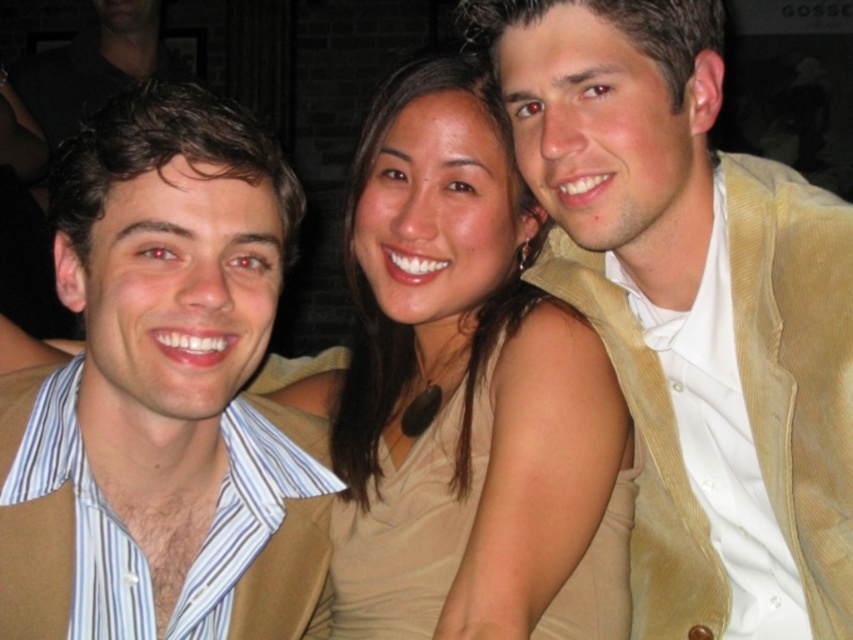
Question: Which of the following is the closest to the observer?

Choices:
 (A) tan corduroy vest at center
 (B) matte brown vest at left
 (C) matte beige dress at center

Answer: (C)

Question: Is the position of matte brown vest at left less distant than that of matte black shirt at left?

Choices:
 (A) no
 (B) yes

Answer: (B)

Question: Is matte brown vest at left smaller than matte beige dress at center?

Choices:
 (A) no
 (B) yes

Answer: (B)

Question: Is matte beige dress at center bigger than matte black shirt at left?

Choices:
 (A) yes
 (B) no

Answer: (B)

Question: Which point is closer to the camera?

Choices:
 (A) (33, 115)
 (B) (612, 317)

Answer: (B)

Question: Among these points, which one is nearest to the camera?

Choices:
 (A) (450, 435)
 (B) (701, 170)

Answer: (A)